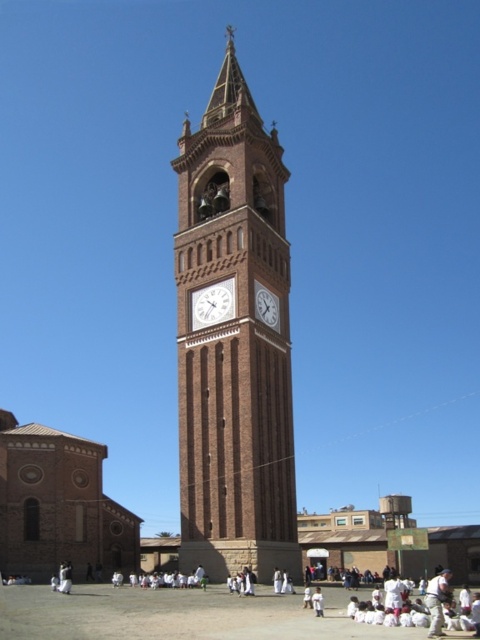
Question: Which of the following is the farthest from the observer?

Choices:
 (A) (257, 314)
 (B) (257, 499)

Answer: (A)

Question: Among these points, which one is nearest to the camera?

Choices:
 (A) (216, 310)
 (B) (255, 314)

Answer: (B)

Question: Observing the image, what is the correct spatial positioning of brown brick clock tower at center in reference to white glossy clock at center?

Choices:
 (A) below
 (B) above

Answer: (B)

Question: Is brown brick clock tower at center wider than white glossy clock at center?

Choices:
 (A) yes
 (B) no

Answer: (A)

Question: Is brown brick clock tower at center in front of brick clock tower at center?

Choices:
 (A) no
 (B) yes

Answer: (B)

Question: Based on their relative distances, which object is nearer to the brick clock tower at center?

Choices:
 (A) white glossy clock at center
 (B) brown brick clock tower at center

Answer: (A)